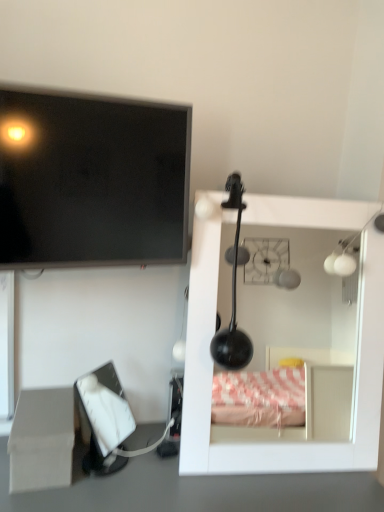
You are a GUI agent. You are given a task and a screenshot of the screen. Output one action in this format:
    pyautogui.click(x=<x>, y=<y>)
    Task: Click on the empty space that is ontop of beige cardboard box at lower left (from a real-world perspective)
    The image size is (384, 512).
    Given the screenshot: What is the action you would take?
    pyautogui.click(x=44, y=397)